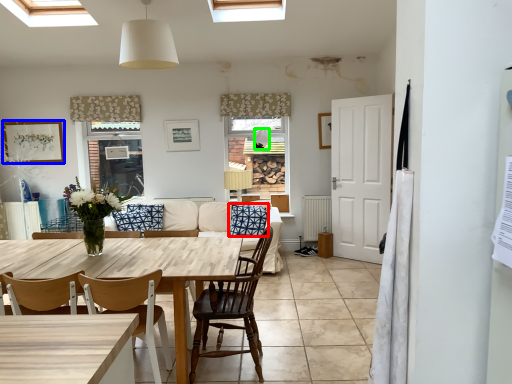
Question: Which object is the closest to the pillow (highlighted by a red box)? Choose among these: picture frame (highlighted by a blue box) or lamp (highlighted by a green box).

Choices:
 (A) picture frame
 (B) lamp

Answer: (B)